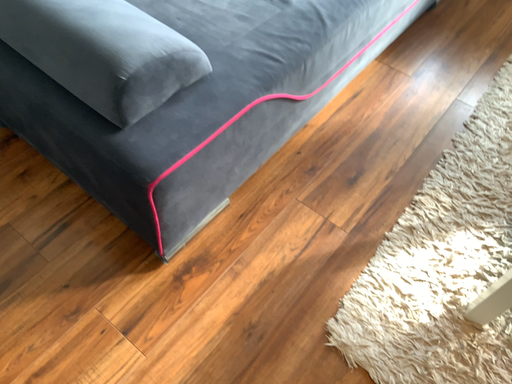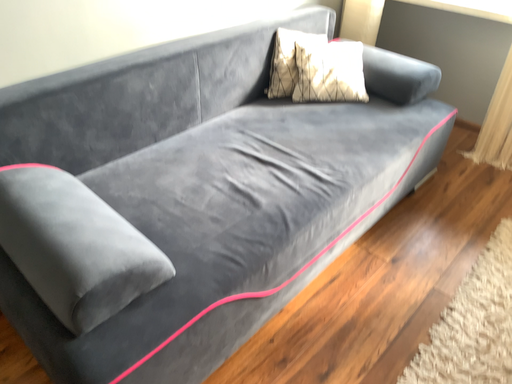
Question: How did the camera likely rotate when shooting the video?

Choices:
 (A) rotated upward
 (B) rotated downward

Answer: (A)